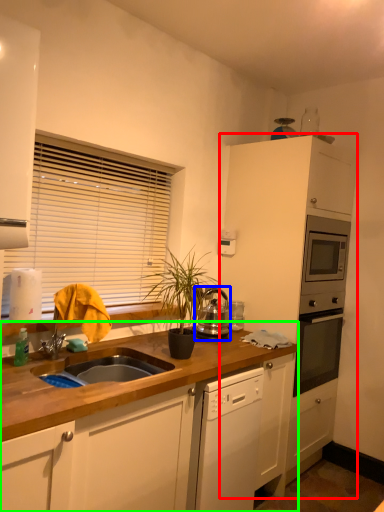
Question: Estimate the real-world distances between objects in this image. Which object is closer to cabinetry (highlighted by a red box), kitchen appliance (highlighted by a blue box) or countertop (highlighted by a green box)?

Choices:
 (A) kitchen appliance
 (B) countertop

Answer: (A)